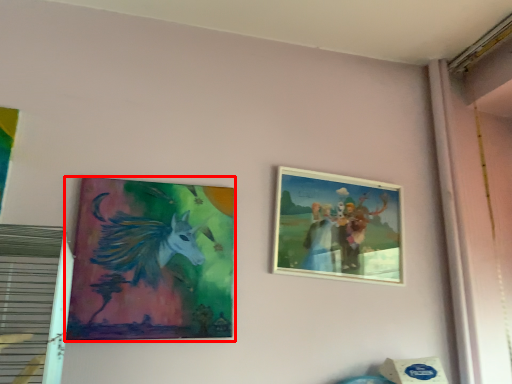
Question: Observing the image, what is the correct spatial positioning of picture frame (annotated by the red box) in reference to picture frame?

Choices:
 (A) right
 (B) left

Answer: (B)